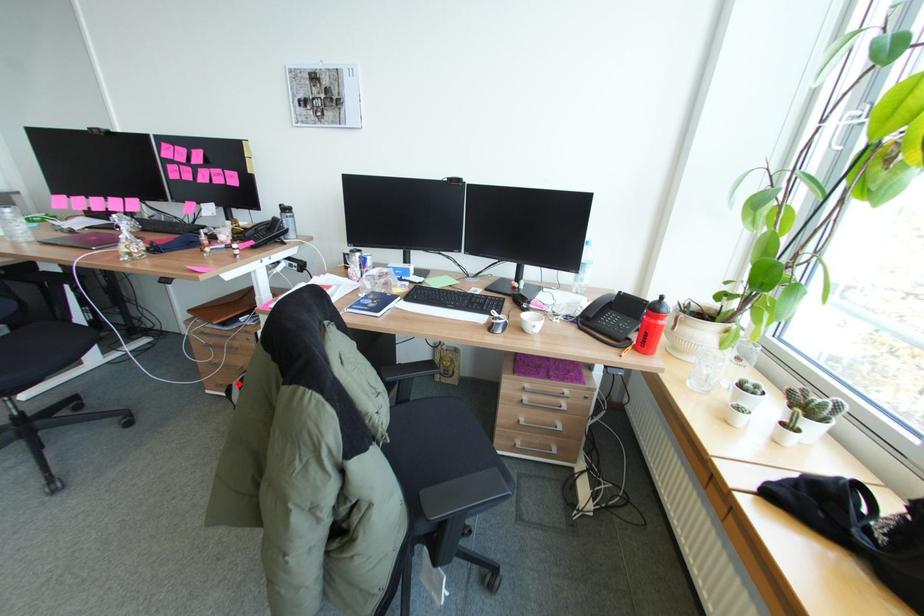
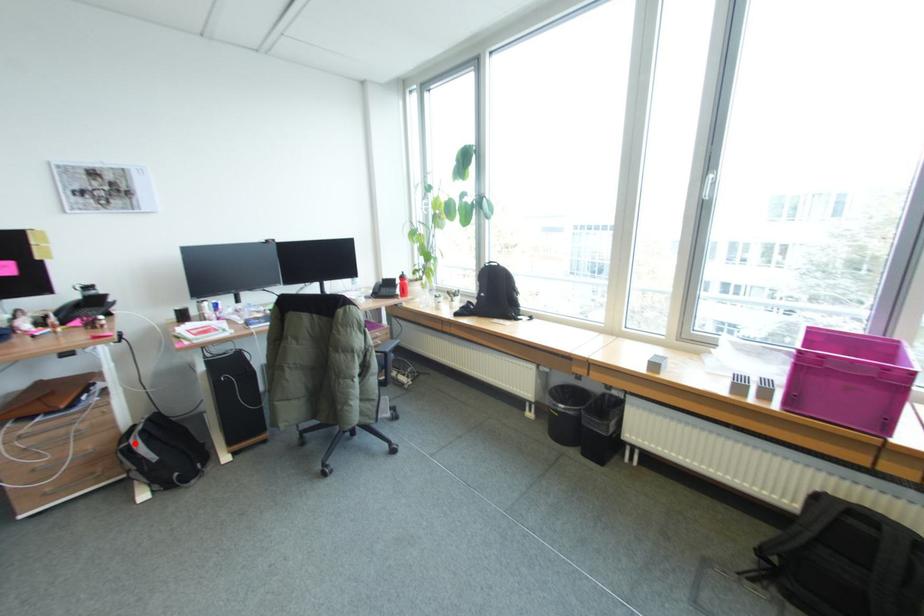
I am providing you with two images of the same scene from different viewpoints. A red point is marked on the first image and another point is marked on the second image. Is the red point in image1 aligned with the point shown in image2?

Yes